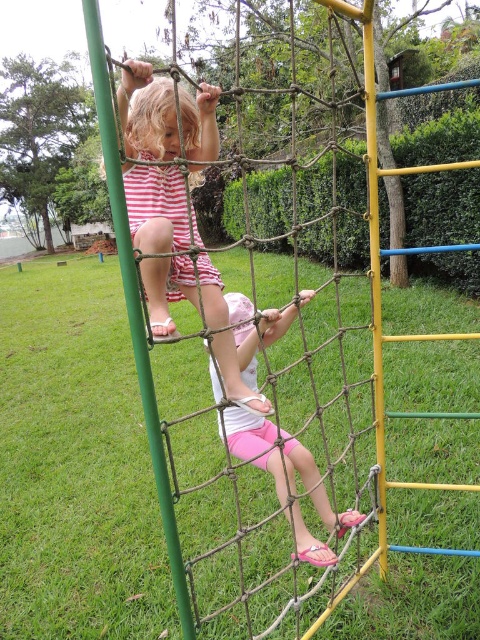
Question: Can you confirm if striped cotton dress at upper left is wider than pink fabric shorts at lower center?

Choices:
 (A) no
 (B) yes

Answer: (A)

Question: Which point appears closest to the camera in this image?

Choices:
 (A) (273, 448)
 (B) (148, 196)

Answer: (B)

Question: Does striped cotton dress at upper left appear under pink fabric shorts at lower center?

Choices:
 (A) yes
 (B) no

Answer: (B)

Question: Which of the following is the farthest from the observer?

Choices:
 (A) (247, 340)
 (B) (219, 292)

Answer: (A)

Question: Is striped cotton dress at upper left wider than pink fabric shorts at lower center?

Choices:
 (A) no
 (B) yes

Answer: (A)